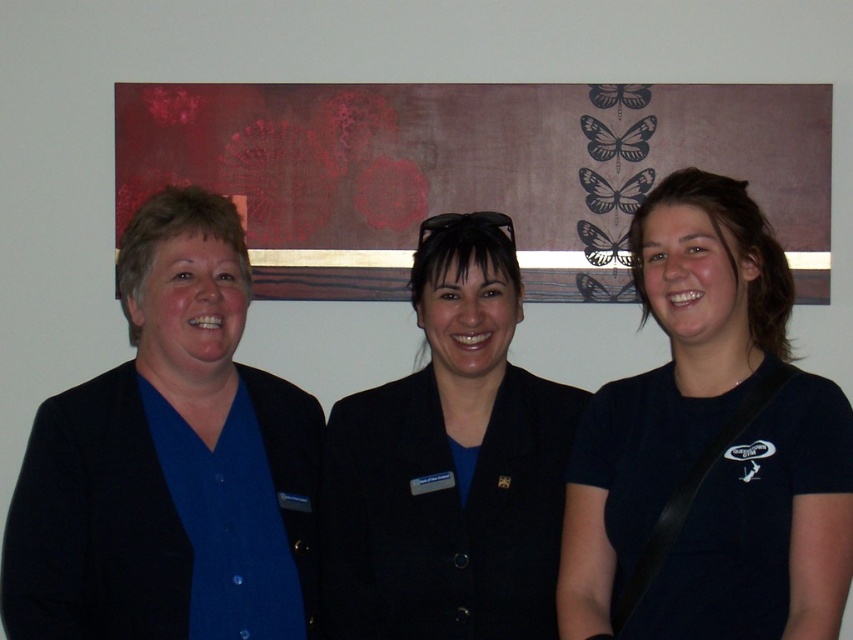
You are a tailor measuring the distance between the black matte shirt at center and the black matte blazer at center for alterations. The minimum required space between clothing items for proper alterations is 12 inches. Can you proceed with the alterations as they are?

The distance between the black matte shirt at center and the black matte blazer at center is only 10.56 inches, which is less than the required 12 inches. Therefore, the alterations cannot be done as they are and more space is needed.

You are designing a layout for a store display and need to place a blue matte shirt at center and a black matte blazer at center. Given their sizes, which item should be placed on a higher shelf to ensure visibility?

The blue matte shirt at center is larger in size compared to the black matte blazer at center, so placing the blue matte shirt at center on a higher shelf will ensure better visibility due to its bigger size.

You are organizing a photo shoot and need to ensure that all participants are visible in the frame. Given that the black matte shirt at center and the blue matte shirt at center are part of the group, which shirt should you focus on to ensure the entire group fits in the frame?

The black matte shirt at center occupies less space than the blue matte shirt at center, so focusing on the blue matte shirt at center ensures the entire group fits in the frame since it takes up more space and adjusting the frame to include it would naturally include the smaller one.